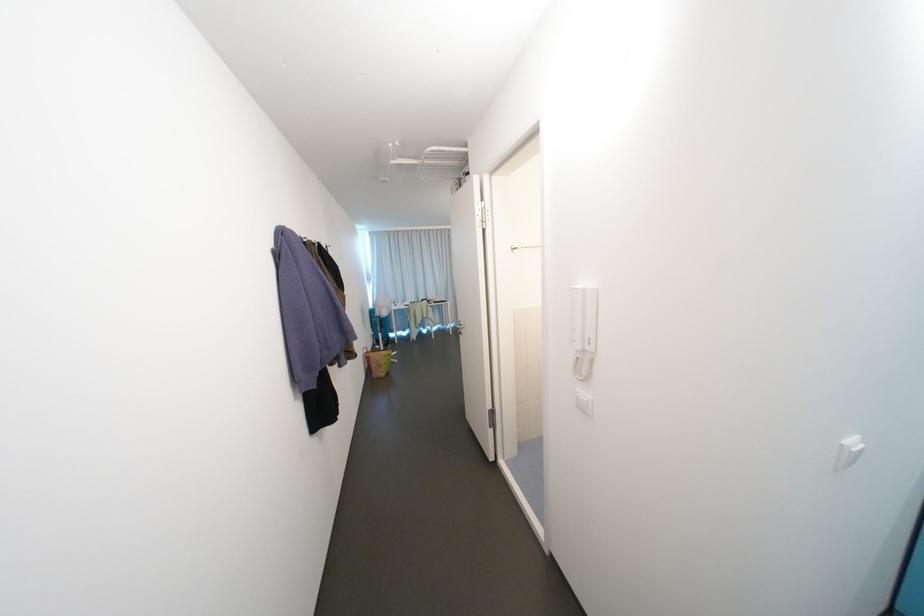
Describe the element at coordinates (524, 246) in the screenshot. Image resolution: width=924 pixels, height=616 pixels. I see `the silver towel rack` at that location.